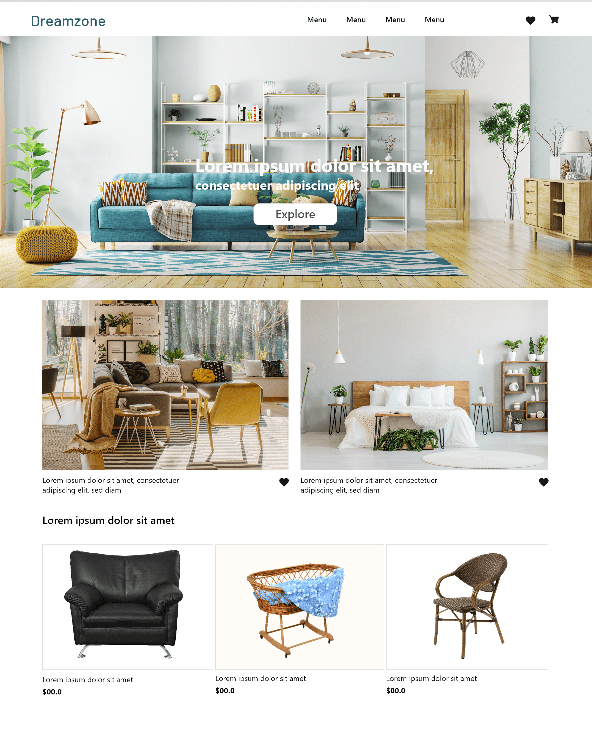
Identify the location of hardwood floor. (480, 244).